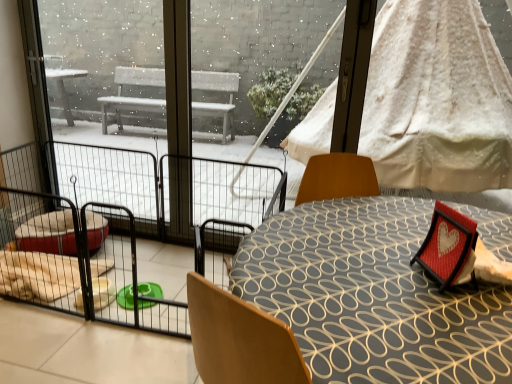
Where is `vacant area that lies in front of red fabric heart frame at lower right`? vacant area that lies in front of red fabric heart frame at lower right is located at coordinates (467, 313).